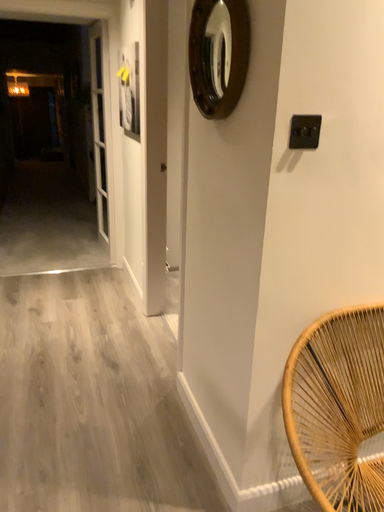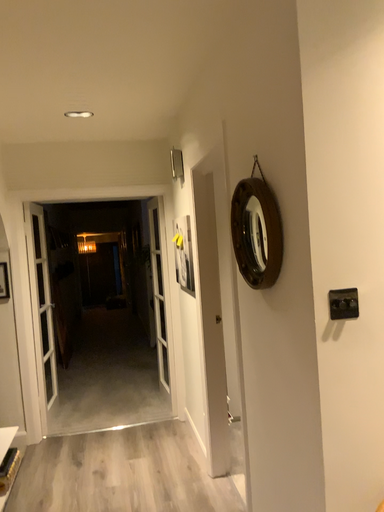
Question: How did the camera likely rotate when shooting the video?

Choices:
 (A) rotated left
 (B) rotated right

Answer: (A)